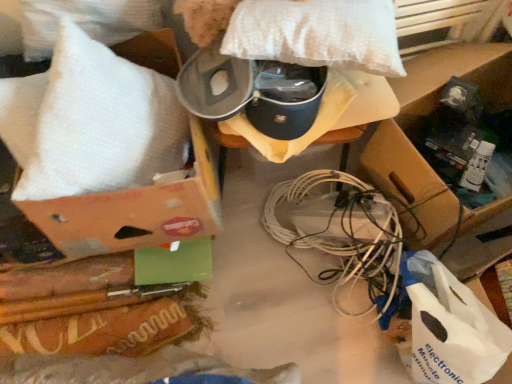
Question: Should I look upward or downward to see white bubble wrap at upper left, the 2th pillow when ordered from right to left?

Choices:
 (A) down
 (B) up

Answer: (B)

Question: Can you confirm if white bubble wrap at upper left, marked as the first pillow in a left-to-right arrangement, is wider than white dotted pillow at upper center, which is the 2th pillow in left-to-right order?

Choices:
 (A) no
 (B) yes

Answer: (A)

Question: Does white bubble wrap at upper left, the 2th pillow when ordered from right to left, have a lesser width compared to white dotted pillow at upper center, the first pillow in the right-to-left sequence?

Choices:
 (A) no
 (B) yes

Answer: (B)

Question: Considering the relative positions of white bubble wrap at upper left, marked as the first pillow in a left-to-right arrangement, and white dotted pillow at upper center, which is the 2th pillow in left-to-right order, in the image provided, is white bubble wrap at upper left, marked as the first pillow in a left-to-right arrangement, to the left of white dotted pillow at upper center, which is the 2th pillow in left-to-right order, from the viewer's perspective?

Choices:
 (A) yes
 (B) no

Answer: (A)

Question: Does white bubble wrap at upper left, marked as the first pillow in a left-to-right arrangement, appear on the right side of white dotted pillow at upper center, which is the 2th pillow in left-to-right order?

Choices:
 (A) no
 (B) yes

Answer: (A)

Question: Is white bubble wrap at upper left, marked as the first pillow in a left-to-right arrangement, taller than white dotted pillow at upper center, which is the 2th pillow in left-to-right order?

Choices:
 (A) no
 (B) yes

Answer: (B)

Question: Is white bubble wrap at upper left, the 2th pillow when ordered from right to left, surrounding white dotted pillow at upper center, the first pillow in the right-to-left sequence?

Choices:
 (A) no
 (B) yes

Answer: (A)

Question: Does white dotted pillow at upper center, which is the 2th pillow in left-to-right order, have a smaller size compared to white plastic wire at center?

Choices:
 (A) yes
 (B) no

Answer: (A)

Question: Considering the relative sizes of white dotted pillow at upper center, the first pillow in the right-to-left sequence, and white plastic wire at center in the image provided, is white dotted pillow at upper center, the first pillow in the right-to-left sequence, thinner than white plastic wire at center?

Choices:
 (A) yes
 (B) no

Answer: (A)

Question: Does white dotted pillow at upper center, the first pillow in the right-to-left sequence, turn towards white plastic wire at center?

Choices:
 (A) no
 (B) yes

Answer: (A)

Question: Are white dotted pillow at upper center, the first pillow in the right-to-left sequence, and white plastic wire at center far apart?

Choices:
 (A) yes
 (B) no

Answer: (B)

Question: Is white dotted pillow at upper center, which is the 2th pillow in left-to-right order, taller than white plastic wire at center?

Choices:
 (A) no
 (B) yes

Answer: (A)

Question: Is white dotted pillow at upper center, which is the 2th pillow in left-to-right order, positioned beyond the bounds of white plastic wire at center?

Choices:
 (A) yes
 (B) no

Answer: (A)

Question: From the image's perspective, would you say white bubble wrap at upper left, the 2th pillow when ordered from right to left, is positioned over brown cardboard box at lower right?

Choices:
 (A) yes
 (B) no

Answer: (A)